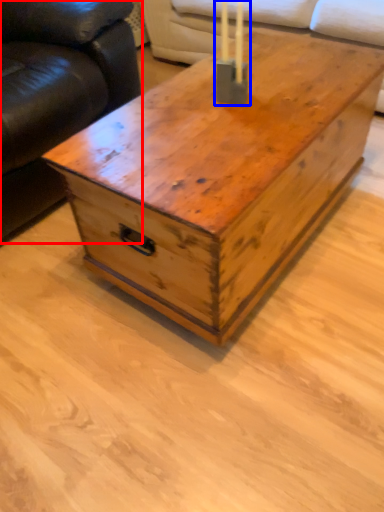
Question: Among these objects, which one is farthest to the camera, studio couch (highlighted by a red box) or candle holder (highlighted by a blue box)?

Choices:
 (A) studio couch
 (B) candle holder

Answer: (B)